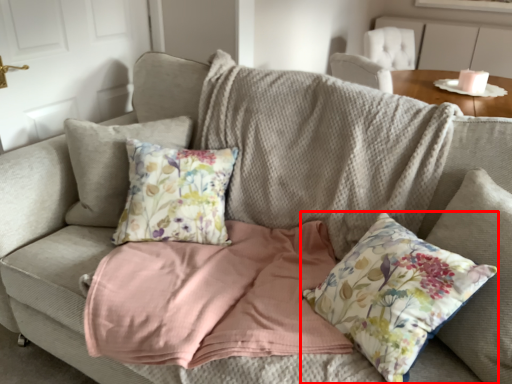
Question: In this image, where is pillow (annotated by the red box) located relative to table?

Choices:
 (A) left
 (B) right

Answer: (A)